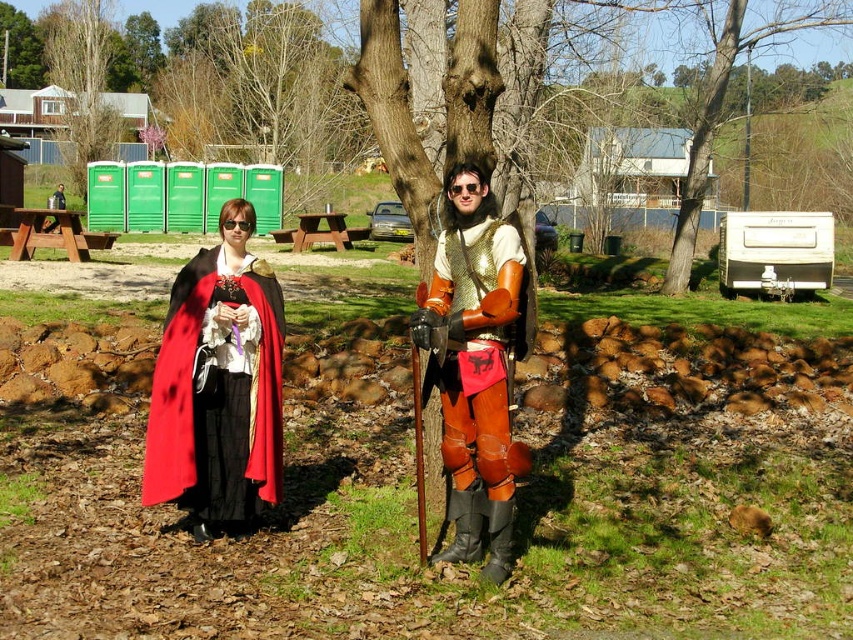
You are a photographer trying to capture a photo of the smooth white trailer at right. You want to ensure the velvet red cape at center is visible in the shot. Based on their positions, can you position yourself so that both objects are in the frame?

The velvet red cape at center is to the left of the smooth white trailer at right, so positioning yourself between them or slightly to the left of the trailer would allow both objects to be captured in the frame.

You are a photographer trying to capture both the matte black cape at center and the green leafy tree at upper left in a single frame. Based on their sizes, which one should you focus on to ensure both fit clearly in the photo?

The matte black cape at center is smaller than the green leafy tree at upper left, so you should focus on the green leafy tree at upper left to ensure both fit clearly in the photo.

You are a photographer trying to capture a closeup shot of the person on the left. You are positioned at the point labeled point (483,253) and want to move towards the person on the left. Is the point labeled point (283,324) behind or in front of you relative to your direction of movement?

The point labeled point (283,324) is behind you because point (483,253) is closer to the viewer than point (283,324). Since you are moving towards the person on the left, the point (283,324) would be behind your current position.